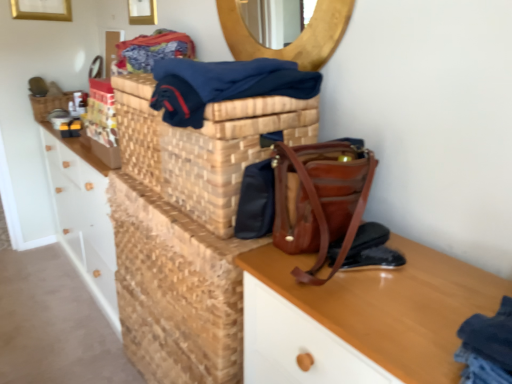
Question: Does brown leather handbag at center appear on the right side of dark blue fabric at upper center?

Choices:
 (A) no
 (B) yes

Answer: (B)

Question: Is brown leather handbag at center thinner than dark blue fabric at upper center?

Choices:
 (A) yes
 (B) no

Answer: (A)

Question: Is the depth of brown leather handbag at center less than that of dark blue fabric at upper center?

Choices:
 (A) no
 (B) yes

Answer: (A)

Question: Is brown leather handbag at center positioned behind dark blue fabric at upper center?

Choices:
 (A) no
 (B) yes

Answer: (B)

Question: From a real-world perspective, does brown leather handbag at center sit lower than dark blue fabric at upper center?

Choices:
 (A) yes
 (B) no

Answer: (A)

Question: Is brown leather handbag at center taller than dark blue fabric at upper center?

Choices:
 (A) no
 (B) yes

Answer: (B)

Question: Is wooden picture frame at upper center, which is the second picture frame in left-to-right order, facing towards black leather shoe at lower right, positioned as the 1th shoe in bottom-to-top order?

Choices:
 (A) yes
 (B) no

Answer: (B)

Question: From a real-world perspective, is wooden picture frame at upper center, which is the second picture frame in left-to-right order, located higher than black leather shoe at lower right, the 2th shoe viewed from the top?

Choices:
 (A) no
 (B) yes

Answer: (B)

Question: From a real-world perspective, is wooden picture frame at upper center, which appears as the first picture frame when viewed from the front, physically below black leather shoe at lower right, the 2th shoe viewed from the top?

Choices:
 (A) no
 (B) yes

Answer: (A)

Question: Does wooden picture frame at upper center, which appears as the first picture frame when viewed from the front, have a lesser height compared to black leather shoe at lower right, the 2th shoe viewed from the top?

Choices:
 (A) yes
 (B) no

Answer: (B)

Question: Is wooden picture frame at upper center, which ranks as the 1th picture frame in right-to-left order, to the right of black leather shoe at lower right, positioned as the 1th shoe in bottom-to-top order, from the viewer's perspective?

Choices:
 (A) no
 (B) yes

Answer: (A)

Question: Is wooden picture frame at upper center, which is the second picture frame in left-to-right order, facing away from black leather shoe at lower right, the 2th shoe viewed from the top?

Choices:
 (A) no
 (B) yes

Answer: (A)

Question: Is woven brown basket at center positioned with its back to leather at center, the 1th shoe in the top-to-bottom sequence?

Choices:
 (A) no
 (B) yes

Answer: (A)